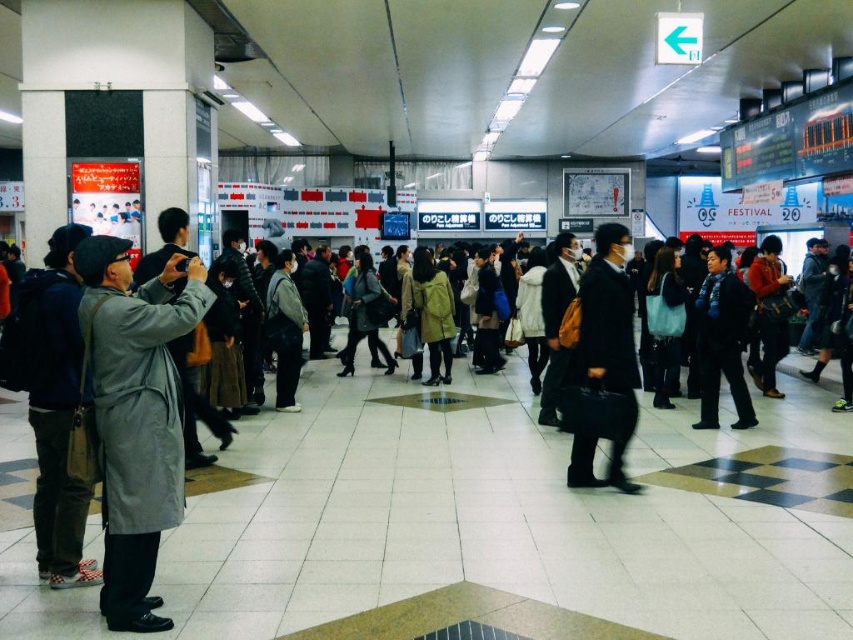
Question: Is gray matte coat at left positioned behind black leather briefcase at center?

Choices:
 (A) yes
 (B) no

Answer: (B)

Question: Can you confirm if gray matte coat at left is bigger than black leather briefcase at center?

Choices:
 (A) yes
 (B) no

Answer: (A)

Question: Which point is farther from the camera taking this photo?

Choices:
 (A) (136, 492)
 (B) (610, 433)

Answer: (B)

Question: Among these objects, which one is nearest to the camera?

Choices:
 (A) gray matte coat at left
 (B) black leather briefcase at center

Answer: (A)

Question: Observing the image, what is the correct spatial positioning of gray matte coat at left in reference to black leather briefcase at center?

Choices:
 (A) right
 (B) left

Answer: (B)

Question: Which of the following is the closest to the observer?

Choices:
 (A) (590, 336)
 (B) (154, 378)

Answer: (B)